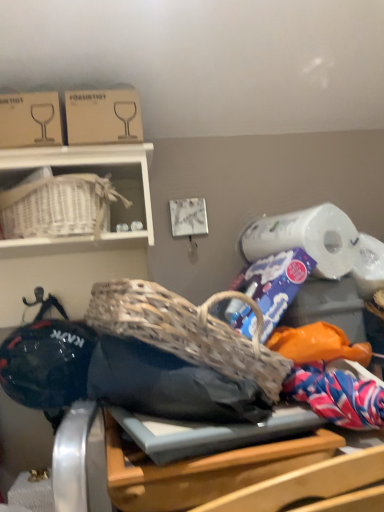
Question: In terms of size, does wooden table at center appear bigger or smaller than cardboard box at upper left, positioned as the 2th cardboard box in left-to-right order?

Choices:
 (A) big
 (B) small

Answer: (A)

Question: Is wooden table at center to the left or to the right of cardboard box at upper left, which ranks as the 1th cardboard box in right-to-left order, in the image?

Choices:
 (A) left
 (B) right

Answer: (B)

Question: Which of these objects is positioned closest to the cardboard box at upper left, the 1th cardboard box from the left?

Choices:
 (A) cardboard box at upper left, which ranks as the 1th cardboard box in right-to-left order
 (B) wooden table at center
 (C) white wicker basket at upper left

Answer: (A)

Question: Estimate the real-world distances between objects in this image. Which object is closer to the cardboard box at upper left, arranged as the 2th cardboard box when viewed from the right?

Choices:
 (A) wooden table at center
 (B) cardboard box at upper left, which ranks as the 1th cardboard box in right-to-left order
 (C) white wicker basket at upper left

Answer: (B)